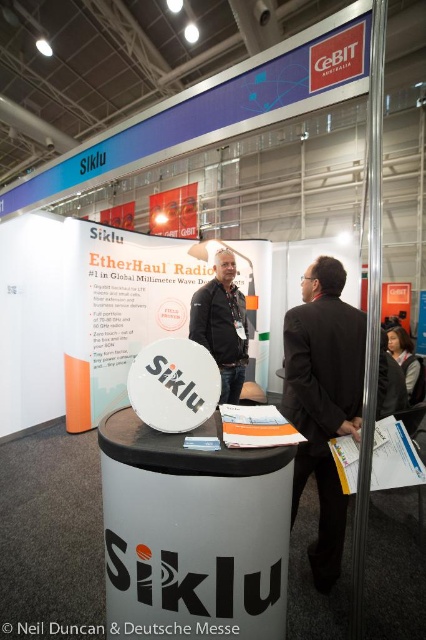
Question: Considering the real-world distances, which object is closest to the orange paper portfolio at center?

Choices:
 (A) black suit at center
 (B) white paper at center

Answer: (B)

Question: Does black suit at center appear over dark gray jacket at center?

Choices:
 (A) yes
 (B) no

Answer: (B)

Question: Is white paper at center above orange paper portfolio at center?

Choices:
 (A) yes
 (B) no

Answer: (B)

Question: Which object is positioned closest to the white paper at center?

Choices:
 (A) orange paper portfolio at center
 (B) black suit at center

Answer: (B)

Question: Among these points, which one is farthest from the camera?

Choices:
 (A) (293, 436)
 (B) (385, 433)
 (C) (347, 312)
 (D) (218, 332)

Answer: (D)

Question: Is dark gray jacket at center positioned in front of orange paper portfolio at center?

Choices:
 (A) no
 (B) yes

Answer: (A)